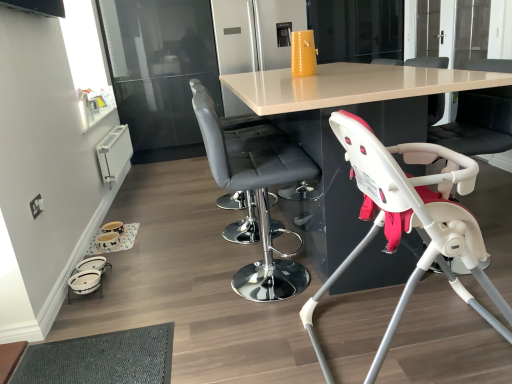
What are the coordinates of `vacant space that is to the left of matte gray bar stool at center, positioned as the second chair in left-to-right order` in the screenshot? It's located at (186, 289).